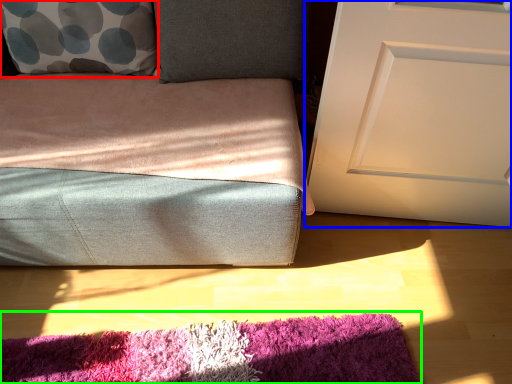
Question: Which object is positioned farthest from throw pillow (highlighted by a red box)? Select from door (highlighted by a blue box) and mat (highlighted by a green box).

Choices:
 (A) door
 (B) mat

Answer: (B)